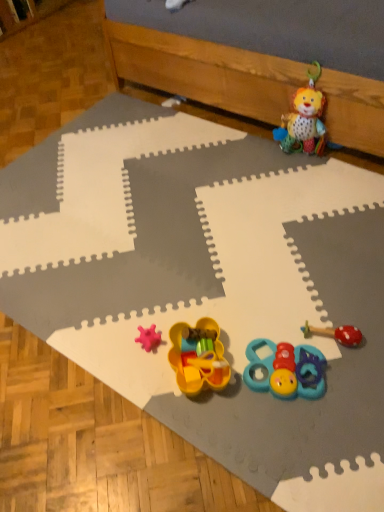
Question: From the image's perspective, is yellow plastic toy at center, which appears as the 2th toy when ordered from the bottom, over plush fabric lion at upper right, the 4th toy in the front-to-back sequence?

Choices:
 (A) yes
 (B) no

Answer: (B)

Question: Can you confirm if yellow plastic toy at center, which appears as the 2th toy when ordered from the bottom, is taller than plush fabric lion at upper right, which appears as the 4th toy when ordered from the bottom?

Choices:
 (A) yes
 (B) no

Answer: (B)

Question: Can you confirm if yellow plastic toy at center, acting as the 1th toy starting from the front, is shorter than plush fabric lion at upper right, which is the 1th toy in back-to-front order?

Choices:
 (A) no
 (B) yes

Answer: (B)

Question: From a real-world perspective, is yellow plastic toy at center, which is the 4th toy from back to front, below plush fabric lion at upper right, the 4th toy in the front-to-back sequence?

Choices:
 (A) yes
 (B) no

Answer: (A)

Question: Is yellow plastic toy at center, acting as the 1th toy starting from the front, oriented towards plush fabric lion at upper right, the 1th toy viewed from the top?

Choices:
 (A) no
 (B) yes

Answer: (A)

Question: Are yellow plastic toy at center, which is the 4th toy from back to front, and plush fabric lion at upper right, the 1th toy viewed from the top, far apart?

Choices:
 (A) no
 (B) yes

Answer: (A)

Question: Is plush fabric lion at upper right, the 4th toy in the front-to-back sequence, in contact with teal rubber teething toy at lower center, acting as the 4th toy starting from the top?

Choices:
 (A) no
 (B) yes

Answer: (A)

Question: Is the depth of plush fabric lion at upper right, which appears as the 4th toy when ordered from the bottom, less than that of teal rubber teething toy at lower center, placed as the 1th toy when sorted from bottom to top?

Choices:
 (A) yes
 (B) no

Answer: (B)

Question: Is plush fabric lion at upper right, the 4th toy in the front-to-back sequence, taller than teal rubber teething toy at lower center, placed as the 1th toy when sorted from bottom to top?

Choices:
 (A) no
 (B) yes

Answer: (B)

Question: Is plush fabric lion at upper right, which is the 1th toy in back-to-front order, oriented towards teal rubber teething toy at lower center, positioned as the second toy in front-to-back order?

Choices:
 (A) yes
 (B) no

Answer: (B)

Question: Can teal rubber teething toy at lower center, the 3th toy when ordered from back to front, be found inside plush fabric lion at upper right, which appears as the 4th toy when ordered from the bottom?

Choices:
 (A) yes
 (B) no

Answer: (B)

Question: Considering the relative sizes of plush fabric lion at upper right, which appears as the 4th toy when ordered from the bottom, and teal rubber teething toy at lower center, the 3th toy when ordered from back to front, in the image provided, is plush fabric lion at upper right, which appears as the 4th toy when ordered from the bottom, wider than teal rubber teething toy at lower center, the 3th toy when ordered from back to front,?

Choices:
 (A) yes
 (B) no

Answer: (B)

Question: Can you confirm if plush fabric lion at upper right, the 4th toy in the front-to-back sequence, is wider than red rubber teething ring at lower right, positioned as the third toy in bottom-to-top order?

Choices:
 (A) no
 (B) yes

Answer: (A)